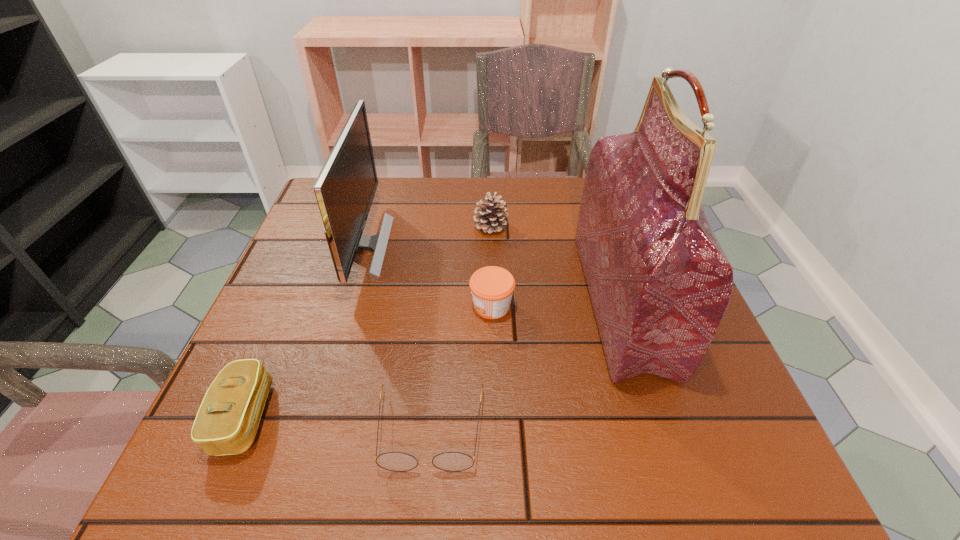
Where is `blank area located on the front-facing side of the handbag`? This screenshot has width=960, height=540. blank area located on the front-facing side of the handbag is located at coordinates (462, 301).

I want to click on vacant space located on the screen side of the second tallest object, so click(523, 245).

Where is `free spot located 0.090m on the left of the third tallest object`? free spot located 0.090m on the left of the third tallest object is located at coordinates (438, 226).

Locate an element on the screen. The height and width of the screenshot is (540, 960). vacant region located 0.250m on the front label of the jam is located at coordinates (350, 306).

Where is `vacant point located 0.100m on the front label of the jam`? vacant point located 0.100m on the front label of the jam is located at coordinates (421, 306).

Find the location of a particular element. free spot located on the front label of the jam is located at coordinates (317, 306).

Find the location of `vacant area situated on the zipper side of the clutch bag`. vacant area situated on the zipper side of the clutch bag is located at coordinates (449, 417).

This screenshot has width=960, height=540. I want to click on monitor at the far edge, so click(345, 188).

Where is `pinecone that is positioned at the far edge`? The width and height of the screenshot is (960, 540). pinecone that is positioned at the far edge is located at coordinates (490, 218).

Where is `clutch bag at the near edge`? This screenshot has height=540, width=960. clutch bag at the near edge is located at coordinates (228, 418).